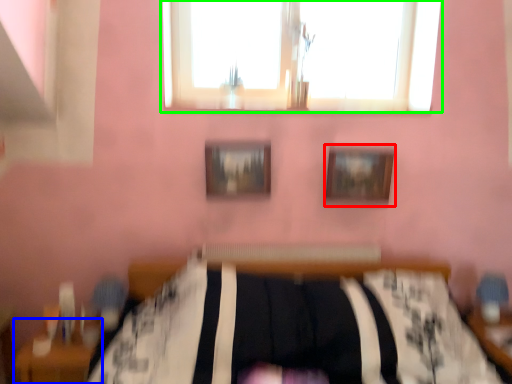
Question: Considering the real-world distances, which object is closest to picture frame (highlighted by a red box)? table (highlighted by a blue box) or window (highlighted by a green box).

Choices:
 (A) table
 (B) window

Answer: (B)